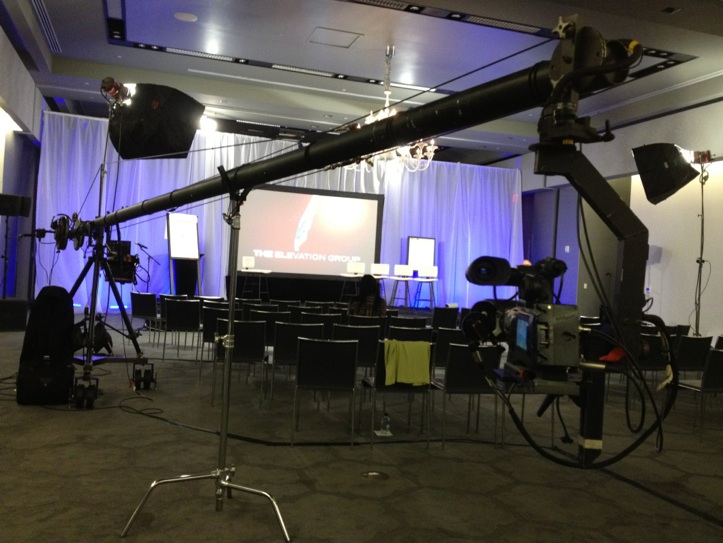
Locate an element on the screen. curtain is located at coordinates (440, 197).